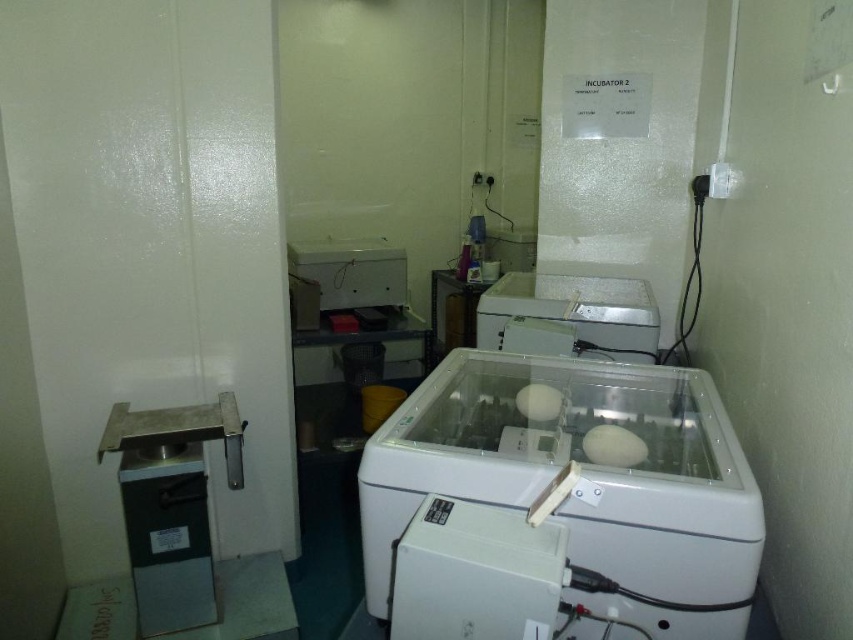
Question: Does transparent plastic incubator at center appear over white plastic incubator at center?

Choices:
 (A) no
 (B) yes

Answer: (A)

Question: Does transparent plastic incubator at center lie in front of white plastic incubator at center?

Choices:
 (A) yes
 (B) no

Answer: (A)

Question: Which point appears farthest from the camera in this image?

Choices:
 (A) (503, 324)
 (B) (685, 401)

Answer: (A)

Question: Which point is farther to the camera?

Choices:
 (A) transparent plastic incubator at center
 (B) white plastic incubator at center

Answer: (B)

Question: Does transparent plastic incubator at center appear over white plastic incubator at center?

Choices:
 (A) yes
 (B) no

Answer: (B)